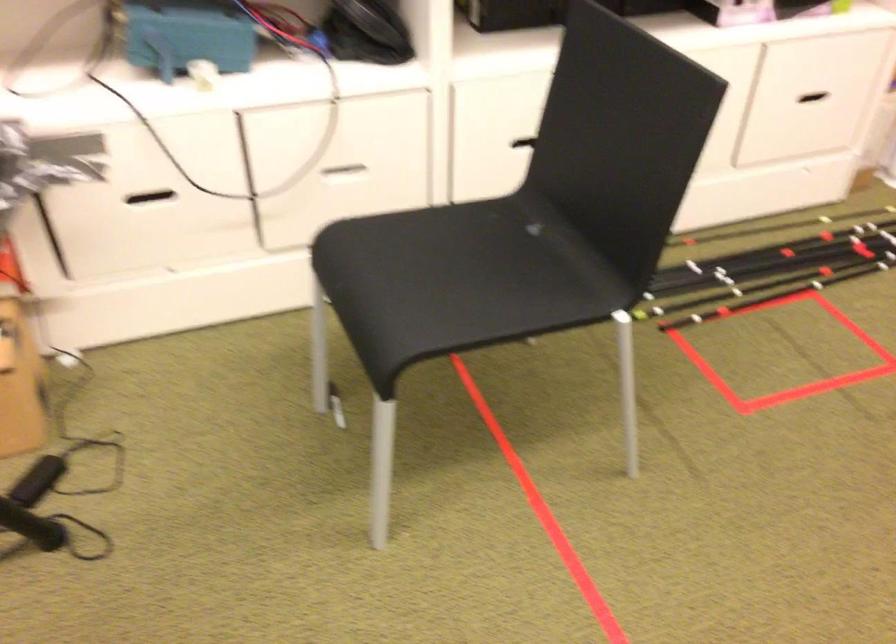
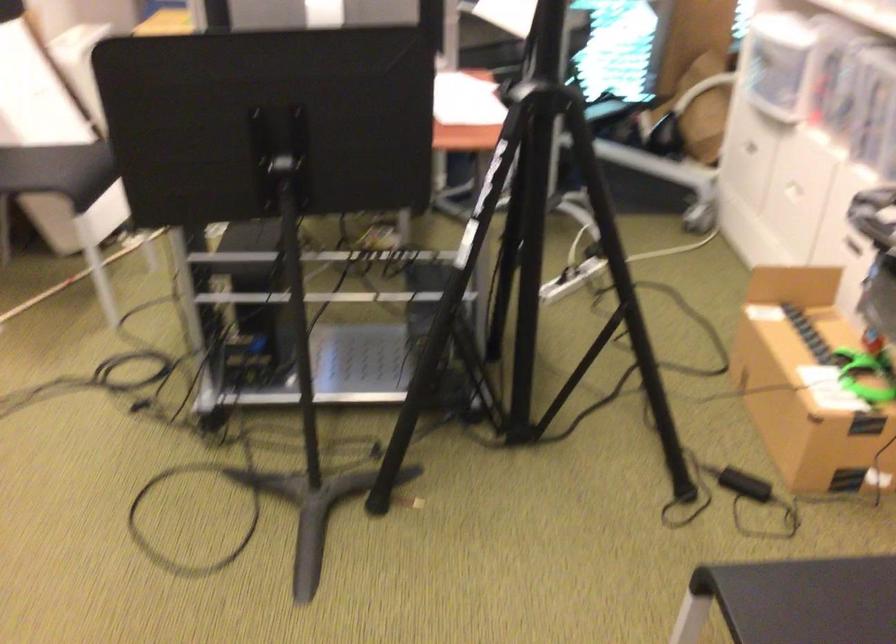
In the second image, find the point that corresponds to (426,289) in the first image.

(842, 597)